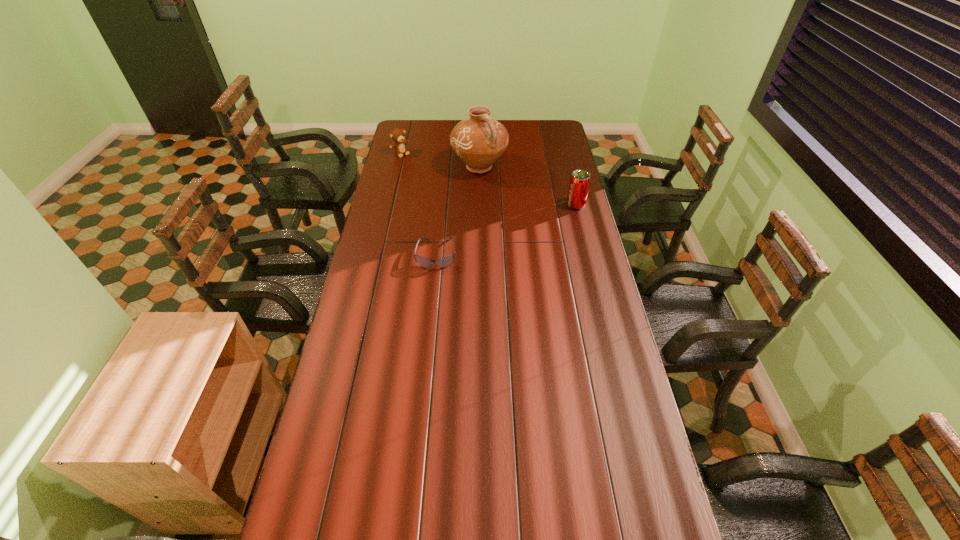
In the image, there is a desktop. Where is `vacant space at the far left corner`? The width and height of the screenshot is (960, 540). vacant space at the far left corner is located at coordinates (402, 126).

Find the location of `blank space at the far right corner`. blank space at the far right corner is located at coordinates (x=558, y=124).

Where is `vacant region at the near right corner of the desktop`? This screenshot has width=960, height=540. vacant region at the near right corner of the desktop is located at coordinates (655, 507).

Locate an element on the screen. free space between the soda can and the tallest object is located at coordinates (528, 186).

Where is `vacant region between the teddy bear and the sunglasses`? This screenshot has width=960, height=540. vacant region between the teddy bear and the sunglasses is located at coordinates (419, 204).

Locate an element on the screen. empty space that is in between the sunglasses and the leftmost object is located at coordinates (419, 204).

Where is `free space that is in between the second tallest object and the nearest object`? This screenshot has height=540, width=960. free space that is in between the second tallest object and the nearest object is located at coordinates (506, 230).

I want to click on blank region between the second shortest object and the tallest object, so click(440, 160).

Where is `vacant area that lies between the second tallest object and the second shortest object`? The image size is (960, 540). vacant area that lies between the second tallest object and the second shortest object is located at coordinates (489, 179).

Where is `free space between the tallest object and the leftmost object`? The image size is (960, 540). free space between the tallest object and the leftmost object is located at coordinates (440, 160).